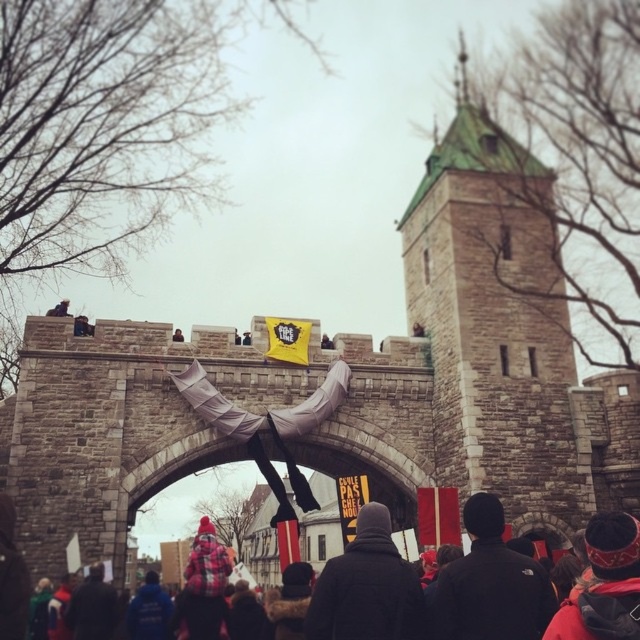
You are a photographer trying to capture the crowd in front of the historic archway. You notice the red knit hat at center and the dark blue jacket at lower left. Which object would appear wider in your photo?

The red knit hat at center would appear wider in the photo since its width is larger than that of the dark blue jacket at lower left.

You are a photographer trying to capture a closeup of the black woolen hat at center and the dark blue jacket at lower left in the scene. Which object should you zoom in on to ensure both are in focus without moving the camera?

The black woolen hat at center has a larger width than the dark blue jacket at lower left, so you should zoom in on the black woolen hat at center to ensure both are in focus without moving the camera.

You are a photographer trying to capture a clear shot of the black woolen hat at center and the dark blue jacket at lower left. Since you want to focus on both objects, which one should you adjust your camera lens to prioritize in terms of height?

The black woolen hat at center is taller than the dark blue jacket at lower left, so you should prioritize adjusting your camera lens to focus on the black woolen hat at center first, as it has a greater height.